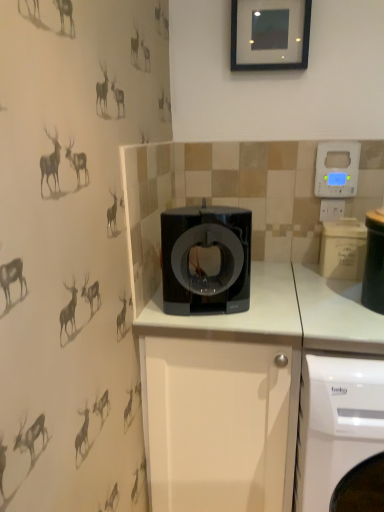
What are the coordinates of `vacant point above white matte cabinet at center (from a real-world perspective)` in the screenshot? It's located at (254, 295).